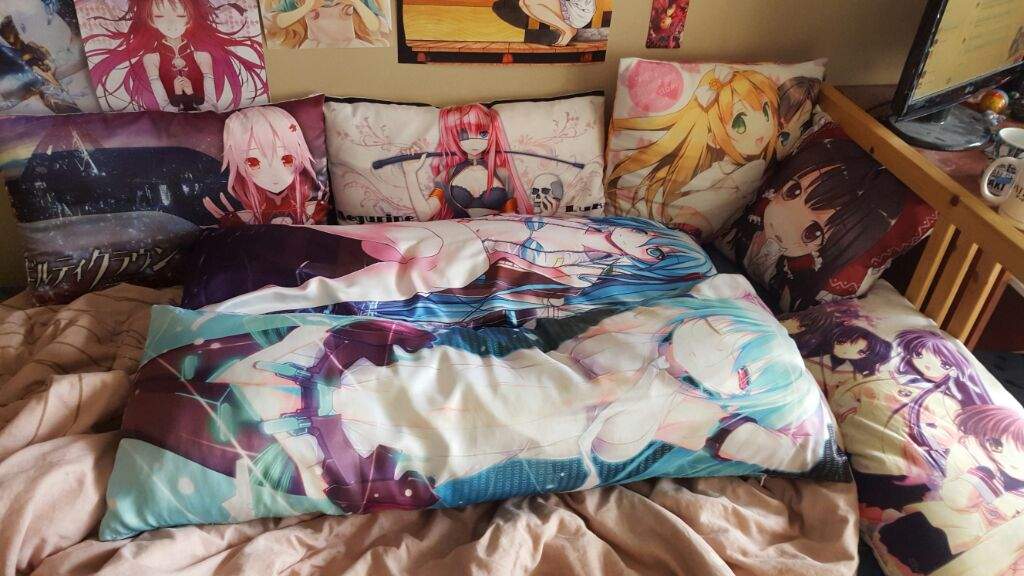
Identify the location of white body pillow. (420, 121).